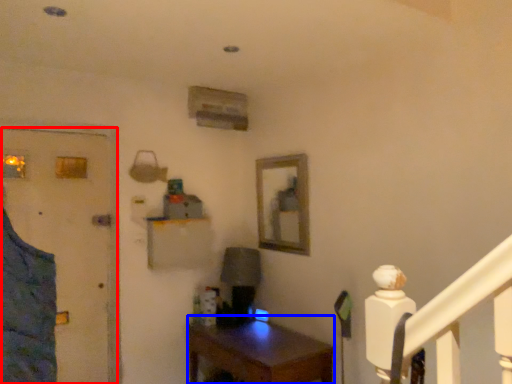
Question: Which object appears farthest to the camera in this image, door (highlighted by a red box) or desk (highlighted by a blue box)?

Choices:
 (A) door
 (B) desk

Answer: (A)